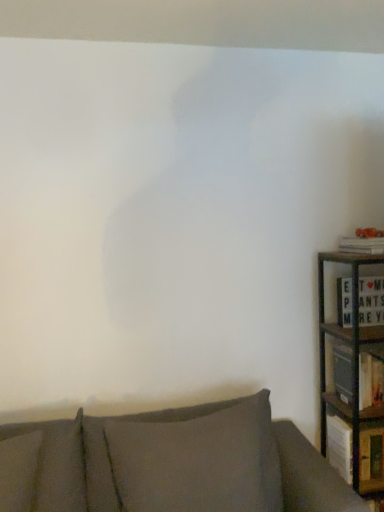
The height and width of the screenshot is (512, 384). Describe the element at coordinates (340, 446) in the screenshot. I see `wooden book at right, positioned as the 3th book in top-to-bottom order` at that location.

Identify the location of textured gray couch at lower center. The height and width of the screenshot is (512, 384). (169, 464).

This screenshot has width=384, height=512. Describe the element at coordinates (352, 364) in the screenshot. I see `metallic green bookcase at right` at that location.

The image size is (384, 512). Find the location of `wooden book at right, positioned as the 3th book in top-to-bottom order`. wooden book at right, positioned as the 3th book in top-to-bottom order is located at coordinates (340, 446).

Can you confirm if textured gray couch at lower center is taller than orange textured book at right, which is the 1th book from top to bottom?

Yes.

Does point (199, 507) appear closer or farther from the camera than point (379, 243)?

Clearly, point (199, 507) is closer to the camera than point (379, 243).

From the image's perspective, does textured gray couch at lower center appear higher than orange textured book at right, the third book from the bottom?

Incorrect, from the image's perspective, textured gray couch at lower center is lower than orange textured book at right, the third book from the bottom.

From a real-world perspective, which is physically above, textured gray couch at lower center or orange textured book at right, which is the 1th book from top to bottom?

orange textured book at right, which is the 1th book from top to bottom, from a real-world perspective.

Could you measure the distance between wooden bookshelf at right and orange textured book at right, which is the 1th book from top to bottom?

wooden bookshelf at right and orange textured book at right, which is the 1th book from top to bottom, are 20.59 inches apart.

Who is more distant, wooden bookshelf at right or orange textured book at right, the third book from the bottom?

wooden bookshelf at right is further from the camera.

Is point (342, 349) closer to camera compared to point (358, 252)?

That is True.

At what (x,y) coordinates should I click in order to perform the action: click on shelf lying below the orange textured book at right, the third book from the bottom (from the image's perspective). Please return your answer as a coordinate pair (x, y). This screenshot has height=512, width=384. Looking at the image, I should click on (352, 372).

From the image's perspective, is white matte letter board at right, the 2th book from the top, on top of textured gray couch at lower center?

Yes, from the image's perspective, white matte letter board at right, the 2th book from the top, is above textured gray couch at lower center.

Considering the sizes of objects white matte letter board at right, the 2th book from the top, and textured gray couch at lower center in the image provided, who is thinner, white matte letter board at right, the 2th book from the top, or textured gray couch at lower center?

Thinner between the two is white matte letter board at right, the 2th book from the top.

Who is bigger, white matte letter board at right, placed as the second book when sorted from bottom to top, or textured gray couch at lower center?

textured gray couch at lower center is bigger.

Is metallic green bookcase at right further to camera compared to textured gray couch at lower center?

Yes.

Are metallic green bookcase at right and textured gray couch at lower center located far from each other?

No, there isn't a large distance between metallic green bookcase at right and textured gray couch at lower center.

Which is more to the right, metallic green bookcase at right or textured gray couch at lower center?

metallic green bookcase at right is more to the right.

Where is `book on the left of white matte letter board at right, placed as the second book when sorted from bottom to top`? book on the left of white matte letter board at right, placed as the second book when sorted from bottom to top is located at coordinates (340, 446).

Does wooden book at right, positioned as the 3th book in top-to-bottom order, have a greater height compared to white matte letter board at right, the 2th book from the top?

Yes, wooden book at right, positioned as the 3th book in top-to-bottom order, is taller than white matte letter board at right, the 2th book from the top.

Is wooden book at right, positioned as the 3th book in top-to-bottom order, facing away from white matte letter board at right, placed as the second book when sorted from bottom to top?

wooden book at right, positioned as the 3th book in top-to-bottom order, does not have its back to white matte letter board at right, placed as the second book when sorted from bottom to top.

Is wooden book at right, positioned as the 3th book in top-to-bottom order, at the left side of white matte letter board at right, placed as the second book when sorted from bottom to top?

Correct, you'll find wooden book at right, positioned as the 3th book in top-to-bottom order, to the left of white matte letter board at right, placed as the second book when sorted from bottom to top.

From a real-world perspective, which object stands above the other?

From a 3D spatial view, white matte letter board at right, placed as the second book when sorted from bottom to top, is above.

Is dark gray fabric pillow at lower center far from white matte letter board at right, placed as the second book when sorted from bottom to top?

That's not correct — dark gray fabric pillow at lower center is a little close to white matte letter board at right, placed as the second book when sorted from bottom to top.

Which is closer, (184, 467) or (350, 320)?

The point (184, 467) is closer to the camera.

Based on the photo, can you confirm if wooden bookshelf at right is thinner than wooden book at right, placed as the 1th book when sorted from bottom to top?

In fact, wooden bookshelf at right might be wider than wooden book at right, placed as the 1th book when sorted from bottom to top.

Which of these two, wooden bookshelf at right or wooden book at right, placed as the 1th book when sorted from bottom to top, is bigger?

wooden book at right, placed as the 1th book when sorted from bottom to top, is bigger.

Is wooden bookshelf at right to the left of wooden book at right, positioned as the 3th book in top-to-bottom order, from the viewer's perspective?

No.

Locate an element on the screen. studio couch that is on the left side of orange textured book at right, the third book from the bottom is located at coordinates (169, 464).

Locate an element on the screen. the 2nd book positioned above the wooden bookshelf at right (from a real-world perspective) is located at coordinates (362, 245).

Considering their positions, is wooden book at right, positioned as the 3th book in top-to-bottom order, positioned further to white matte letter board at right, placed as the second book when sorted from bottom to top, than textured gray couch at lower center?

textured gray couch at lower center is positioned further to the anchor white matte letter board at right, placed as the second book when sorted from bottom to top.

Based on their spatial positions, is metallic green bookcase at right or wooden bookshelf at right further from orange textured book at right, which is the 1th book from top to bottom?

wooden bookshelf at right lies further to orange textured book at right, which is the 1th book from top to bottom, than the other object.

Which object lies further to the anchor point textured gray couch at lower center, metallic green bookcase at right or orange textured book at right, the third book from the bottom?

orange textured book at right, the third book from the bottom, is further to textured gray couch at lower center.

When comparing their distances from wooden book at right, placed as the 1th book when sorted from bottom to top, does metallic green bookcase at right or dark gray fabric pillow at lower center seem closer?

metallic green bookcase at right is closer to wooden book at right, placed as the 1th book when sorted from bottom to top.

Estimate the real-world distances between objects in this image. Which object is closer to orange textured book at right, the third book from the bottom, textured gray couch at lower center or metallic green bookcase at right?

metallic green bookcase at right is positioned closer to the anchor orange textured book at right, the third book from the bottom.

Which object lies further to the anchor point textured gray couch at lower center, wooden book at right, positioned as the 3th book in top-to-bottom order, or orange textured book at right, the third book from the bottom?

Among the two, orange textured book at right, the third book from the bottom, is located further to textured gray couch at lower center.

Estimate the real-world distances between objects in this image. Which object is further from metallic green bookcase at right, white matte letter board at right, placed as the second book when sorted from bottom to top, or wooden book at right, placed as the 1th book when sorted from bottom to top?

white matte letter board at right, placed as the second book when sorted from bottom to top.

From the picture: When comparing their distances from wooden book at right, positioned as the 3th book in top-to-bottom order, does white matte letter board at right, placed as the second book when sorted from bottom to top, or metallic green bookcase at right seem closer?

Based on the image, metallic green bookcase at right appears to be nearer to wooden book at right, positioned as the 3th book in top-to-bottom order.

Identify the location of bookcase between dark gray fabric pillow at lower center and white matte letter board at right, the 2th book from the top, from left to right. Image resolution: width=384 pixels, height=512 pixels. (352, 364).

This screenshot has height=512, width=384. I want to click on book between orange textured book at right, which is the 1th book from top to bottom, and wooden book at right, placed as the 1th book when sorted from bottom to top, vertically, so click(371, 301).

Locate an element on the screen. This screenshot has width=384, height=512. shelf between textured gray couch at lower center and white matte letter board at right, the 2th book from the top, in the front-back direction is located at coordinates (352, 372).

The width and height of the screenshot is (384, 512). I want to click on bookcase between textured gray couch at lower center and white matte letter board at right, placed as the second book when sorted from bottom to top, from front to back, so click(x=352, y=364).